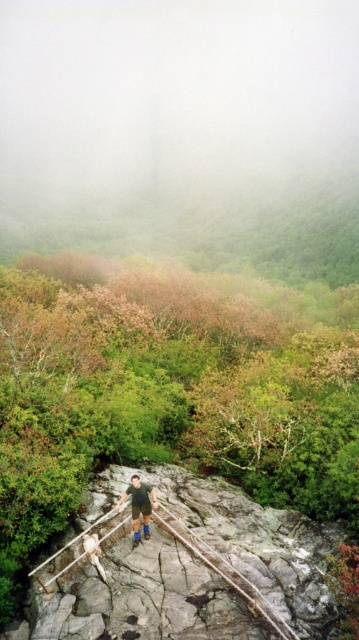
You are standing at the edge of the rocky outcrop with the wooden railing and want to take a photo of both the person and the distant forest. Which point, point (192, 576) or point (136, 538), is closer to you?

Point (192, 576) is closer to the camera than point (136, 538), so it is closer to you.

You are standing on the rocky outcrop and want to cross to the other side of the valley. The rusty metal suspension bridge at center and the blue denim shorts at center are in your view. Which object is located to the right of the other?

The rusty metal suspension bridge at center is positioned on the right side of blue denim shorts at center, so the suspension bridge is to the right of the blue denim shorts.